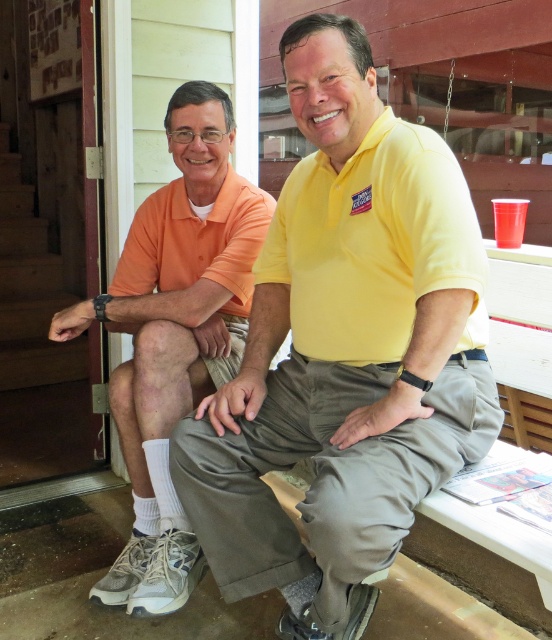
Question: Does yellow matte shirt at center have a larger size compared to orange cotton shirt at left?

Choices:
 (A) no
 (B) yes

Answer: (B)

Question: Can you confirm if yellow matte shirt at center is positioned above orange cotton shirt at left?

Choices:
 (A) yes
 (B) no

Answer: (B)

Question: Which point is closer to the camera?

Choices:
 (A) yellow matte shirt at center
 (B) orange cotton shirt at left

Answer: (A)

Question: Observing the image, what is the correct spatial positioning of yellow matte shirt at center in reference to orange cotton shirt at left?

Choices:
 (A) left
 (B) right

Answer: (B)

Question: Which of the following is the farthest from the observer?

Choices:
 (A) (139, 275)
 (B) (375, 230)

Answer: (A)